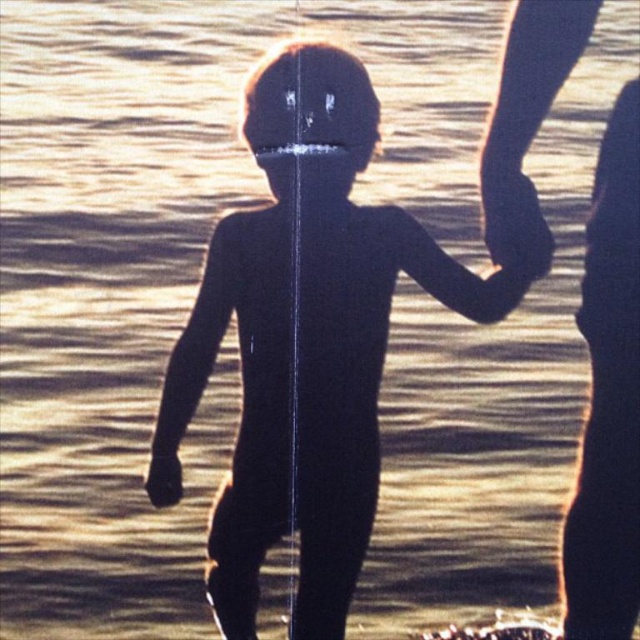
You are a photographer trying to capture the child in the water. You need to ensure that the black matte skin at center and the black matte hand at right are both visible in your shot. Given their sizes, which object should you focus on to ensure both are in frame?

The black matte skin at center has a greater height compared to the black matte hand at right. Therefore, focusing on the black matte skin at center will ensure both are in frame since it is larger and likely central to the composition.

You are designing a swimsuit for a child and need to ensure the sleeves can cover both the black matte skin at center and the black matte hand at right. Which part requires wider sleeves?

The black matte skin at center requires wider sleeves since its width surpasses that of the black matte hand at right.